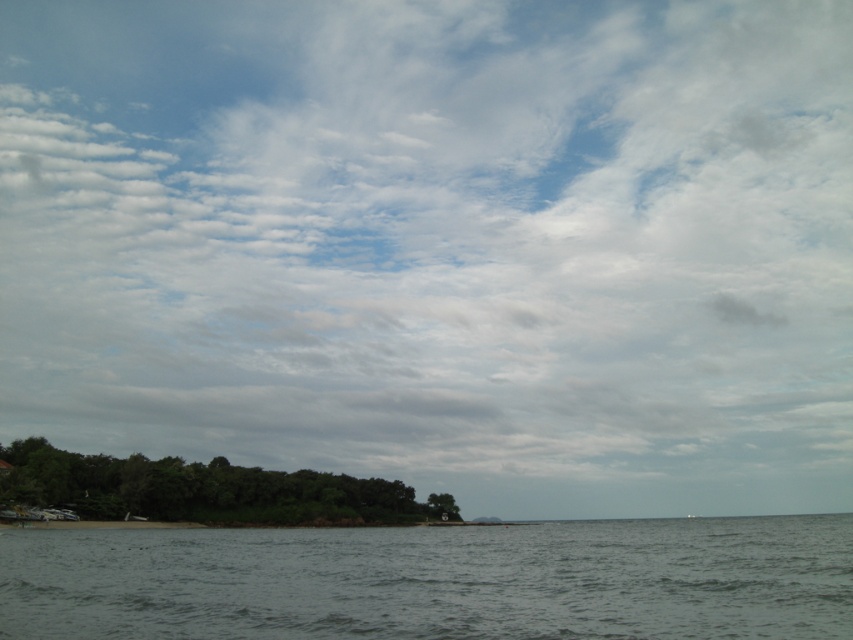
Can you confirm if gray matte water at lower center is positioned to the right of green leafy island at lower left?

Correct, you'll find gray matte water at lower center to the right of green leafy island at lower left.

This screenshot has height=640, width=853. What do you see at coordinates (434, 580) in the screenshot?
I see `gray matte water at lower center` at bounding box center [434, 580].

Find the location of a particular element. The width and height of the screenshot is (853, 640). gray matte water at lower center is located at coordinates click(434, 580).